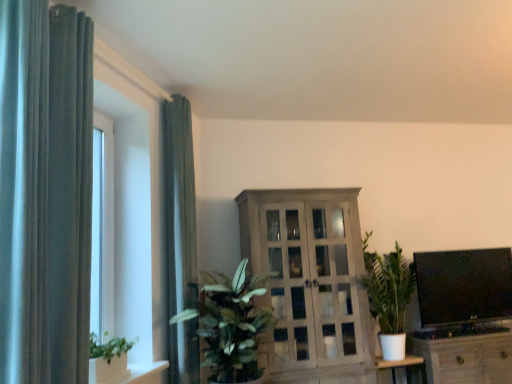
Question: Can you confirm if wooden cabinet at center, acting as the first cabinetry starting from the left, is bigger than wooden cabinet at lower right, which appears as the second cabinetry when viewed from the left?

Choices:
 (A) no
 (B) yes

Answer: (B)

Question: Is wooden cabinet at center, which ranks as the second cabinetry in right-to-left order, smaller than wooden cabinet at lower right, which appears as the second cabinetry when viewed from the left?

Choices:
 (A) no
 (B) yes

Answer: (A)

Question: From the image's perspective, is wooden cabinet at center, which ranks as the second cabinetry in right-to-left order, above wooden cabinet at lower right, which appears as the second cabinetry when viewed from the left?

Choices:
 (A) yes
 (B) no

Answer: (A)

Question: Can you confirm if wooden cabinet at center, which ranks as the second cabinetry in right-to-left order, is shorter than wooden cabinet at lower right, arranged as the 1th cabinetry when viewed from the right?

Choices:
 (A) yes
 (B) no

Answer: (B)

Question: Can you confirm if wooden cabinet at center, which ranks as the second cabinetry in right-to-left order, is thinner than wooden cabinet at lower right, arranged as the 1th cabinetry when viewed from the right?

Choices:
 (A) yes
 (B) no

Answer: (A)

Question: Is there a large distance between wooden cabinet at center, acting as the first cabinetry starting from the left, and wooden cabinet at lower right, which appears as the second cabinetry when viewed from the left?

Choices:
 (A) no
 (B) yes

Answer: (A)

Question: Is black glossy flat screen tv at right further to the viewer compared to white glossy shelf at lower left?

Choices:
 (A) yes
 (B) no

Answer: (A)

Question: Is black glossy flat screen tv at right bigger than white glossy shelf at lower left?

Choices:
 (A) no
 (B) yes

Answer: (B)

Question: From a real-world perspective, is black glossy flat screen tv at right located beneath white glossy shelf at lower left?

Choices:
 (A) no
 (B) yes

Answer: (A)

Question: Is black glossy flat screen tv at right oriented away from white glossy shelf at lower left?

Choices:
 (A) yes
 (B) no

Answer: (B)

Question: Would you say white glossy shelf at lower left is part of black glossy flat screen tv at right's contents?

Choices:
 (A) yes
 (B) no

Answer: (B)

Question: Is black glossy flat screen tv at right wider than white glossy shelf at lower left?

Choices:
 (A) no
 (B) yes

Answer: (B)

Question: From the image's perspective, does wooden cabinet at center, acting as the first cabinetry starting from the left, appear lower than green leafy plant at center?

Choices:
 (A) no
 (B) yes

Answer: (A)